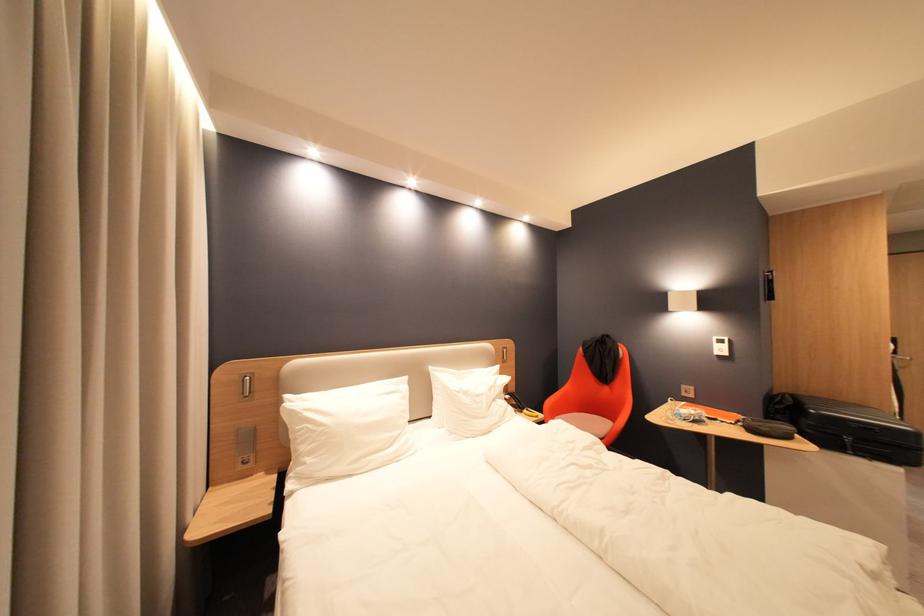
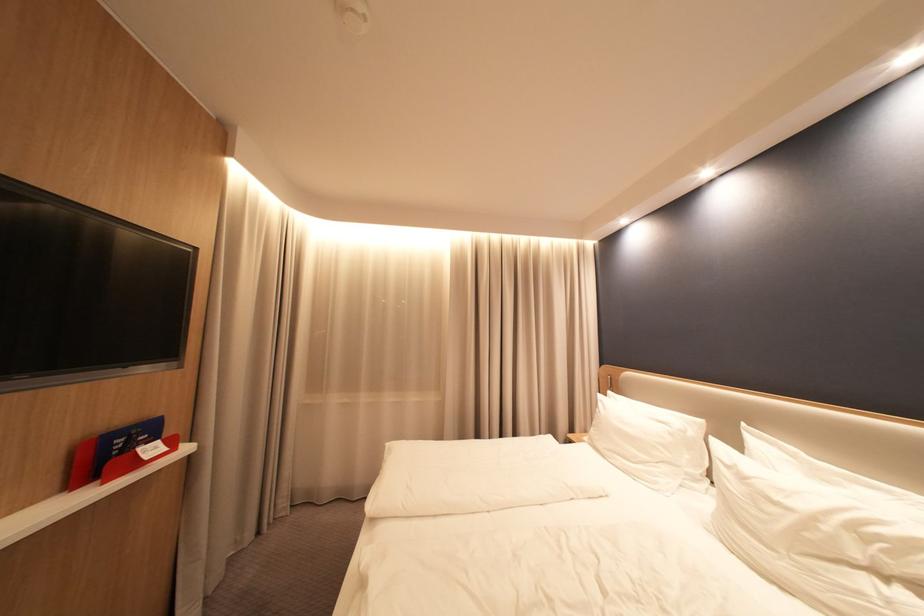
Where in the second image is the point corresponding to (x=468, y=391) from the first image?

(737, 464)